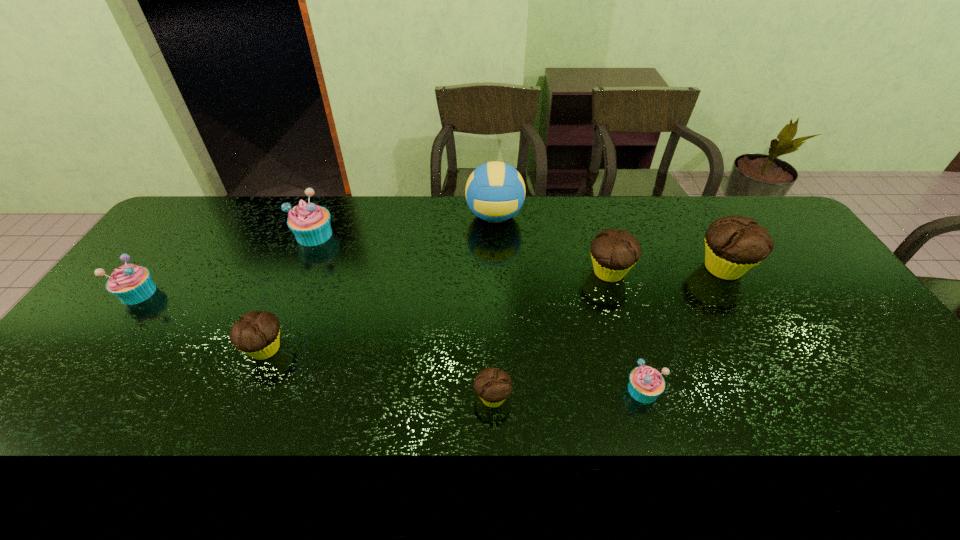
You are a GUI agent. You are given a task and a screenshot of the screen. Output one action in this format:
    pyautogui.click(x=<x>, y=<y>)
    Task: Click on the blue volleyball
    The height and width of the screenshot is (540, 960).
    Given the screenshot: What is the action you would take?
    pyautogui.click(x=495, y=191)

What are the coordinates of `volleyball` in the screenshot? It's located at (495, 191).

Find the location of a particular element. This screenshot has width=960, height=540. the rightmost muffin is located at coordinates (734, 244).

Find the location of `the rightmost chocolate muffin`. the rightmost chocolate muffin is located at coordinates (734, 244).

The width and height of the screenshot is (960, 540). In order to click on the farthest muffin in this screenshot , I will do `click(310, 223)`.

Where is `the biggest blue muffin`? The height and width of the screenshot is (540, 960). the biggest blue muffin is located at coordinates (310, 223).

Locate an element on the screen. the third smallest chocolate muffin is located at coordinates (614, 253).

The height and width of the screenshot is (540, 960). In order to click on the leftmost object in this screenshot , I will do `click(131, 284)`.

This screenshot has width=960, height=540. Identify the location of the leftmost muffin. (131, 284).

Locate an element on the screen. This screenshot has height=540, width=960. the fifth farthest muffin is located at coordinates tap(257, 333).